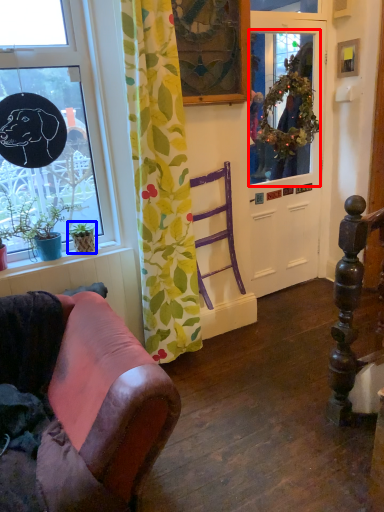
Question: Which point is closer to the camera, window screen (highlighted by a red box) or houseplant (highlighted by a blue box)?

Choices:
 (A) window screen
 (B) houseplant

Answer: (B)